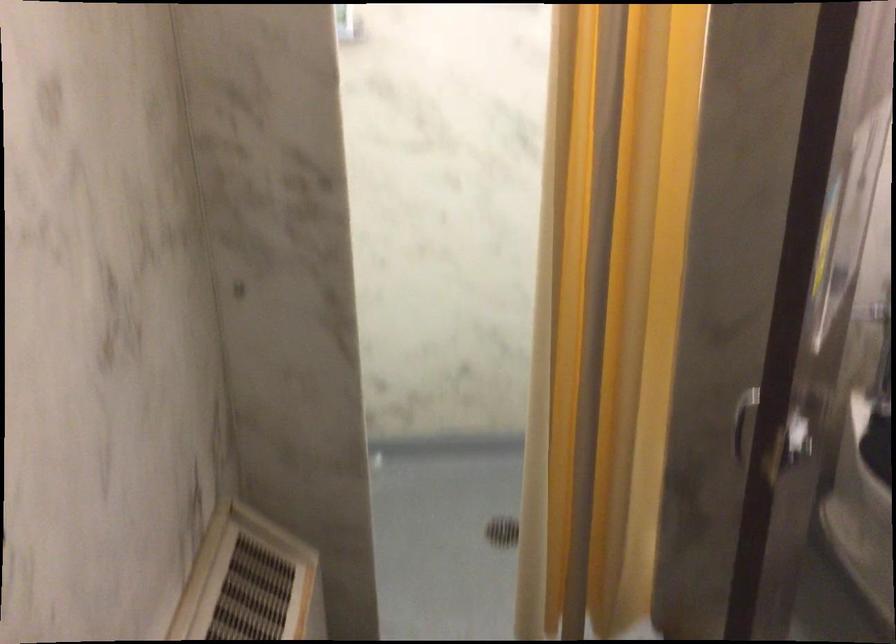
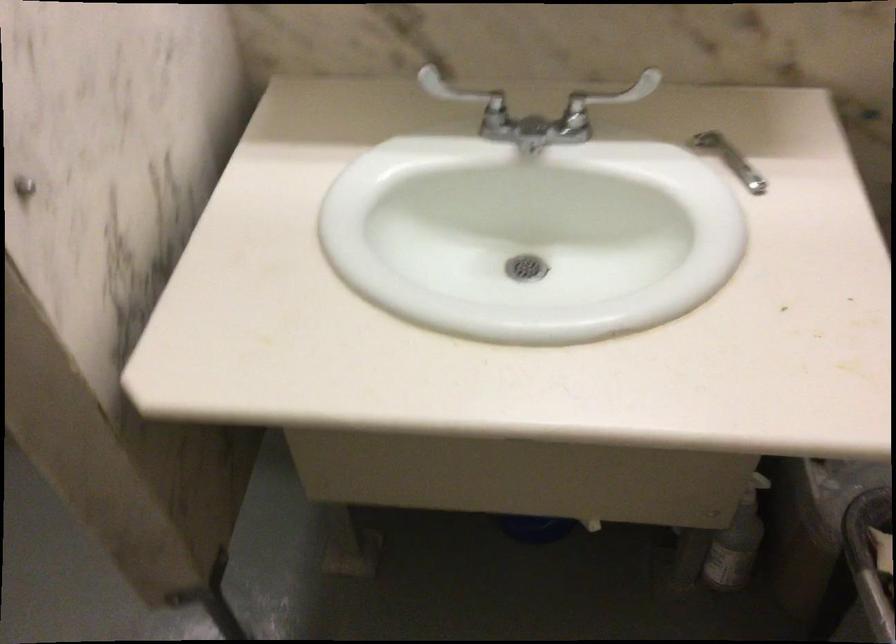
The images are taken continuously from a first-person perspective. In which direction is your viewpoint rotating?

The camera rotated toward right-down.